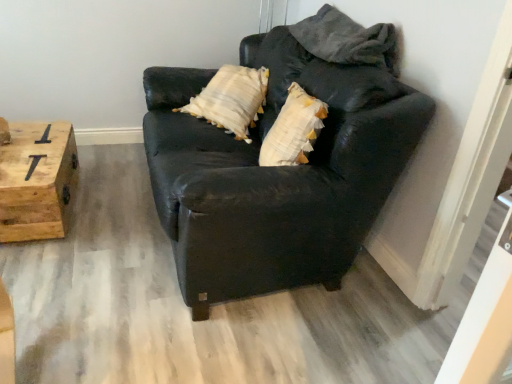
Question: Is matte black couch at center wider than wooden crate at left?

Choices:
 (A) yes
 (B) no

Answer: (A)

Question: From a real-world perspective, is matte black couch at center located higher than wooden crate at left?

Choices:
 (A) yes
 (B) no

Answer: (A)

Question: Does matte black couch at center have a lesser height compared to wooden crate at left?

Choices:
 (A) yes
 (B) no

Answer: (B)

Question: Would you say matte black couch at center contains wooden crate at left?

Choices:
 (A) yes
 (B) no

Answer: (B)

Question: Does matte black couch at center have a greater height compared to wooden crate at left?

Choices:
 (A) yes
 (B) no

Answer: (A)

Question: From the image's perspective, is matte black couch at center on wooden crate at left?

Choices:
 (A) yes
 (B) no

Answer: (A)

Question: Would you say wooden crate at left is a long distance from matte black couch at center?

Choices:
 (A) no
 (B) yes

Answer: (A)

Question: Is wooden crate at left bigger than matte black couch at center?

Choices:
 (A) yes
 (B) no

Answer: (B)

Question: Could you tell me if wooden crate at left is turned towards matte black couch at center?

Choices:
 (A) no
 (B) yes

Answer: (A)

Question: Is wooden crate at left outside matte black couch at center?

Choices:
 (A) yes
 (B) no

Answer: (A)

Question: Is matte black couch at center inside wooden crate at left?

Choices:
 (A) no
 (B) yes

Answer: (A)

Question: Can you confirm if wooden crate at left is shorter than matte black couch at center?

Choices:
 (A) yes
 (B) no

Answer: (A)

Question: In terms of size, does wooden crate at left appear bigger or smaller than matte black couch at center?

Choices:
 (A) small
 (B) big

Answer: (A)